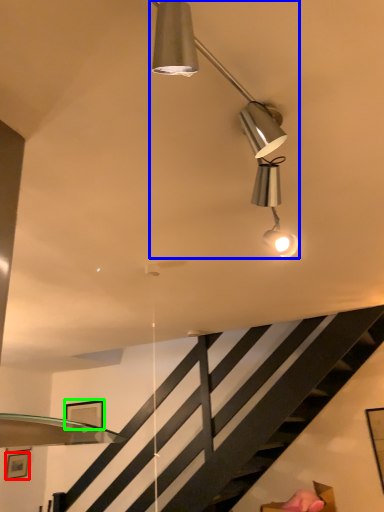
Question: Estimate the real-world distances between objects in this image. Which object is closer to picture frame (highlighted by a red box), lamp (highlighted by a blue box) or picture frame (highlighted by a green box)?

Choices:
 (A) lamp
 (B) picture frame

Answer: (B)